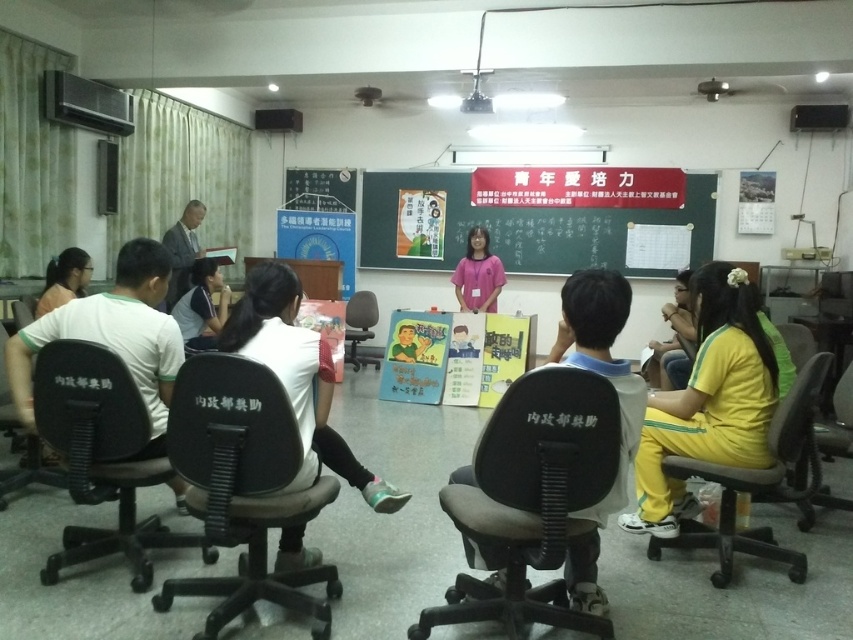
You are standing in the classroom facing the chalkboard. There are two points marked in the scene, point (x=828, y=444) and point (x=193, y=244). Which point is closer to you?

Point (x=828, y=444) is closer to the viewer than point (x=193, y=244).

You are a participant in the classroom and need to locate the green matte poster at center and the yellow fabric pants at lower right. From your seated position, which object is positioned to the left?

The green matte poster at center is to the left of the yellow fabric pants at lower right, so the green matte poster at center is positioned to the left.